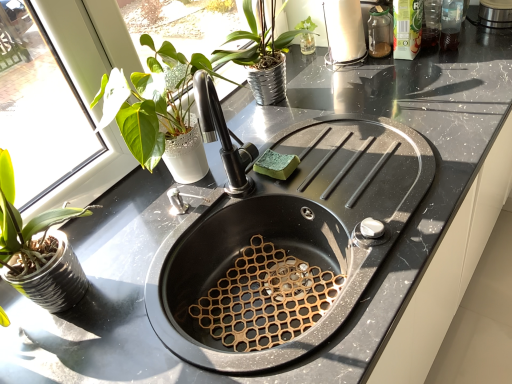
Question: Is black matte sink at center in front of or behind white glossy paper towel holder at upper right in the image?

Choices:
 (A) behind
 (B) front

Answer: (B)

Question: In terms of size, does black matte sink at center appear bigger or smaller than white glossy paper towel holder at upper right?

Choices:
 (A) small
 (B) big

Answer: (B)

Question: Which of these objects is positioned farthest from the white glossy paper towel holder at upper right?

Choices:
 (A) green sponge at sink
 (B) black matte sink at center

Answer: (B)

Question: Which object is the closest to the white glossy paper towel holder at upper right?

Choices:
 (A) black matte sink at center
 (B) green sponge at sink

Answer: (B)